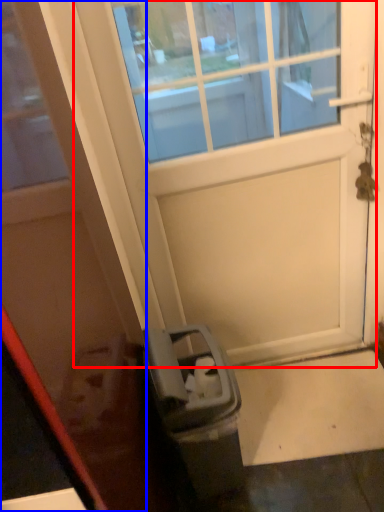
Question: Among these objects, which one is farthest to the camera, door (highlighted by a red box) or door (highlighted by a blue box)?

Choices:
 (A) door
 (B) door

Answer: (A)